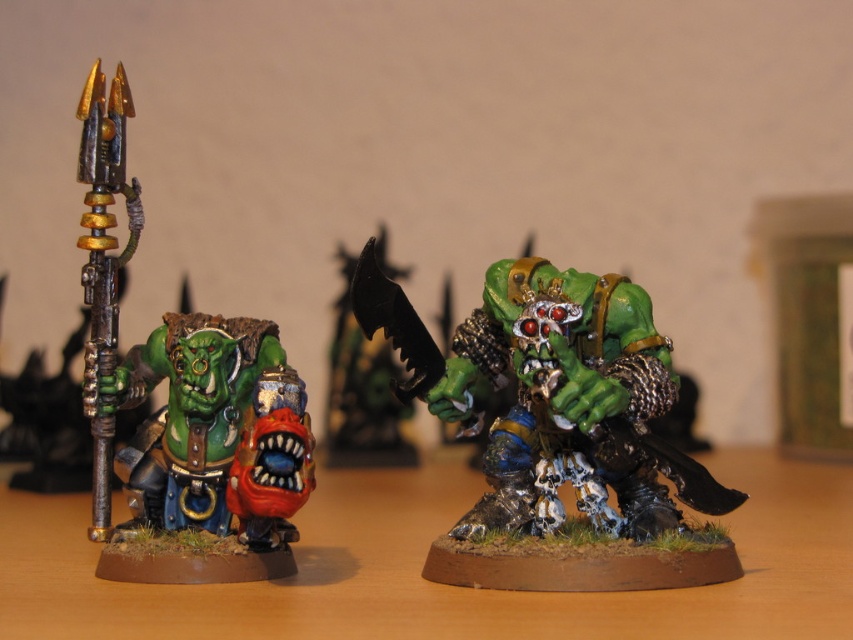
Question: From the image, what is the correct spatial relationship of green metallic armor at center in relation to green matte orc head at center?

Choices:
 (A) above
 (B) below

Answer: (A)

Question: Which point appears farthest from the camera in this image?

Choices:
 (A) (567, 288)
 (B) (170, 380)

Answer: (B)

Question: Which of the following is the farthest from the observer?

Choices:
 (A) (186, 515)
 (B) (717, 561)

Answer: (A)

Question: Which point is closer to the camera?

Choices:
 (A) green metallic armor at center
 (B) green matte orc head at center

Answer: (B)

Question: Is green metallic armor at center to the right of green matte orc head at center from the viewer's perspective?

Choices:
 (A) yes
 (B) no

Answer: (A)

Question: Does green metallic armor at center have a lesser width compared to green matte orc head at center?

Choices:
 (A) yes
 (B) no

Answer: (B)